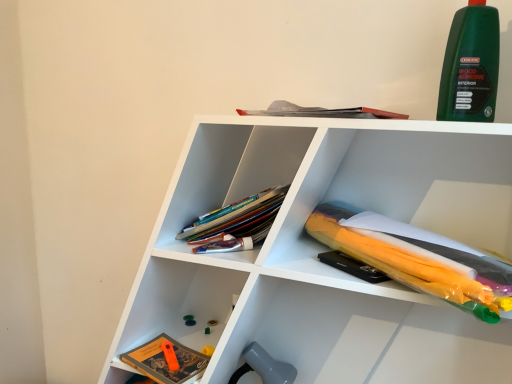
What do you see at coordinates (230, 171) in the screenshot?
I see `matte plastic books at center` at bounding box center [230, 171].

This screenshot has height=384, width=512. What are the coordinates of `green plastic toy at lower center` in the screenshot? It's located at (189, 320).

Based on the photo, measure the distance between point (417,281) and camera.

Point (417,281) and camera are 72.80 centimeters apart.

In order to click on translucent plastic umbrella at lower right, the 2th book in the left-to-right sequence in this screenshot , I will do `click(412, 261)`.

Find the location of `green matte wood adhesive at upper right`. green matte wood adhesive at upper right is located at coordinates (470, 65).

Is translucent plastic umbrella at lower right, the 1th book in the top-to-bottom sequence, not close to matte plastic books at center?

Actually, translucent plastic umbrella at lower right, the 1th book in the top-to-bottom sequence, and matte plastic books at center are a little close together.

Considering the relative sizes of translucent plastic umbrella at lower right, the 2th book in the left-to-right sequence, and matte plastic books at center in the image provided, is translucent plastic umbrella at lower right, the 2th book in the left-to-right sequence, taller than matte plastic books at center?

No, translucent plastic umbrella at lower right, the 2th book in the left-to-right sequence, is not taller than matte plastic books at center.

From the image's perspective, is translucent plastic umbrella at lower right, the second book from the bottom, beneath matte plastic books at center?

Yes, from the image's perspective, translucent plastic umbrella at lower right, the second book from the bottom, is below matte plastic books at center.

At what (x,y) coordinates should I click in order to perform the action: click on book on the right of matte plastic books at center. Please return your answer as a coordinate pair (x, y). The height and width of the screenshot is (384, 512). Looking at the image, I should click on (412, 261).

Is hardcover book at lower left, which is counted as the 1th book, starting from the bottom, situated inside translucent plastic umbrella at lower right, the second book from the bottom, or outside?

hardcover book at lower left, which is counted as the 1th book, starting from the bottom, is not enclosed by translucent plastic umbrella at lower right, the second book from the bottom.

Is hardcover book at lower left, the 1th book viewed from the left, at the right side of translucent plastic umbrella at lower right, the 2th book in the left-to-right sequence?

No.

From a real-world perspective, which is physically above, hardcover book at lower left, the 1th book viewed from the left, or translucent plastic umbrella at lower right, the second book from the bottom?

In real-world perspective, translucent plastic umbrella at lower right, the second book from the bottom, is above.

Can you confirm if green plastic toy at lower center is smaller than hardcover book at lower left, marked as the second book in a top-to-bottom arrangement?

Yes.

Considering the relative sizes of green plastic toy at lower center and hardcover book at lower left, marked as the second book in a top-to-bottom arrangement, in the image provided, is green plastic toy at lower center wider than hardcover book at lower left, marked as the second book in a top-to-bottom arrangement,?

In fact, green plastic toy at lower center might be narrower than hardcover book at lower left, marked as the second book in a top-to-bottom arrangement.

What's the angular difference between green plastic toy at lower center and hardcover book at lower left, marked as the second book in a top-to-bottom arrangement,'s facing directions?

The angle between the facing direction of green plastic toy at lower center and the facing direction of hardcover book at lower left, marked as the second book in a top-to-bottom arrangement, is 23.3 degrees.

This screenshot has width=512, height=384. I want to click on book below the translucent plastic umbrella at lower right, the 2th book in the left-to-right sequence (from the image's perspective), so click(166, 361).

Is point (448, 275) positioned in front of point (193, 364)?

Yes, it is in front of point (193, 364).

Based on the photo, measure the distance between translucent plastic umbrella at lower right, which is counted as the first book, starting from the right, and hardcover book at lower left, which is counted as the 1th book, starting from the bottom.

translucent plastic umbrella at lower right, which is counted as the first book, starting from the right, and hardcover book at lower left, which is counted as the 1th book, starting from the bottom, are 20.51 inches apart from each other.

Considering the sizes of objects translucent plastic umbrella at lower right, which is counted as the first book, starting from the right, and hardcover book at lower left, the 1th book viewed from the left, in the image provided, who is thinner, translucent plastic umbrella at lower right, which is counted as the first book, starting from the right, or hardcover book at lower left, the 1th book viewed from the left,?

hardcover book at lower left, the 1th book viewed from the left, is thinner.

Consider the image. Is white plastic umbrella at upper right completely or partially inside hardcover book at lower left, marked as the second book in a top-to-bottom arrangement?

No, white plastic umbrella at upper right is not surrounded by hardcover book at lower left, marked as the second book in a top-to-bottom arrangement.

Considering the sizes of objects hardcover book at lower left, the second book positioned from the right, and white plastic umbrella at upper right in the image provided, who is wider, hardcover book at lower left, the second book positioned from the right, or white plastic umbrella at upper right?

With larger width is white plastic umbrella at upper right.

Between point (141, 352) and point (213, 137), which one is positioned behind?

Point (141, 352)

From the image's perspective, is hardcover book at lower left, the second book positioned from the right, on top of white plastic umbrella at upper right?

Incorrect, from the image's perspective, hardcover book at lower left, the second book positioned from the right, is lower than white plastic umbrella at upper right.

Is translucent plastic umbrella at lower right, the 2th book in the left-to-right sequence, smaller than green matte wood adhesive at upper right?

No.

Which object is wider, translucent plastic umbrella at lower right, the 1th book in the top-to-bottom sequence, or green matte wood adhesive at upper right?

Wider between the two is translucent plastic umbrella at lower right, the 1th book in the top-to-bottom sequence.

Which is in front, translucent plastic umbrella at lower right, the second book from the bottom, or green matte wood adhesive at upper right?

translucent plastic umbrella at lower right, the second book from the bottom, is more forward.

What's the angular difference between green matte wood adhesive at upper right and hardcover book at lower left, the 1th book viewed from the left,'s facing directions?

15.2 degrees.

From a real-world perspective, is green matte wood adhesive at upper right physically located above or below hardcover book at lower left, the second book positioned from the right?

In terms of real-world spatial position, green matte wood adhesive at upper right is above hardcover book at lower left, the second book positioned from the right.

Based on their sizes in the image, would you say green matte wood adhesive at upper right is bigger or smaller than hardcover book at lower left, the 1th book viewed from the left?

Clearly, green matte wood adhesive at upper right is larger in size than hardcover book at lower left, the 1th book viewed from the left.

In the scene shown: Which point is more forward, (447,63) or (143,369)?

The point (447,63) is more forward.

Locate an element on the screen. This screenshot has height=384, width=512. cabinet located above the translucent plastic umbrella at lower right, which is counted as the first book, starting from the right (from a real-world perspective) is located at coordinates (230, 171).

In order to click on book below the translucent plastic umbrella at lower right, which is counted as the first book, starting from the right (from the image's perspective) in this screenshot , I will do `click(166, 361)`.

When comparing their distances from green plastic toy at lower center, does matte plastic books at center or green matte wood adhesive at upper right seem further?

Among the two, green matte wood adhesive at upper right is located further to green plastic toy at lower center.

Based on their spatial positions, is hardcover book at lower left, the 1th book viewed from the left, or translucent plastic umbrella at lower right, which is counted as the first book, starting from the right, further from white plastic umbrella at upper right?

hardcover book at lower left, the 1th book viewed from the left, lies further to white plastic umbrella at upper right than the other object.

From the image, which object appears to be nearer to green plastic toy at lower center, translucent plastic umbrella at lower right, the 2th book in the left-to-right sequence, or matte plastic books at center?

The object closer to green plastic toy at lower center is matte plastic books at center.

Estimate the real-world distances between objects in this image. Which object is closer to translucent plastic umbrella at lower right, which is counted as the first book, starting from the right, matte plastic books at center or white plastic umbrella at upper right?

white plastic umbrella at upper right is positioned closer to the anchor translucent plastic umbrella at lower right, which is counted as the first book, starting from the right.

From the image, which object appears to be farther from translucent plastic umbrella at lower right, which is counted as the first book, starting from the right, green plastic toy at lower center or white plastic umbrella at upper right?

green plastic toy at lower center is positioned further to the anchor translucent plastic umbrella at lower right, which is counted as the first book, starting from the right.

Looking at the image, which one is located closer to green plastic toy at lower center, translucent plastic umbrella at lower right, the 2th book in the left-to-right sequence, or white plastic umbrella at upper right?

white plastic umbrella at upper right is closer to green plastic toy at lower center.

Which object lies further to the anchor point green matte wood adhesive at upper right, hardcover book at lower left, which is counted as the 1th book, starting from the bottom, or matte plastic books at center?

hardcover book at lower left, which is counted as the 1th book, starting from the bottom.

Which object lies further to the anchor point matte plastic books at center, hardcover book at lower left, which is counted as the 1th book, starting from the bottom, or translucent plastic umbrella at lower right, which is counted as the first book, starting from the right?

hardcover book at lower left, which is counted as the 1th book, starting from the bottom, is further to matte plastic books at center.

Identify the location of cabinet between green matte wood adhesive at upper right and hardcover book at lower left, the second book positioned from the right, in the vertical direction. This screenshot has width=512, height=384. click(x=230, y=171).

Locate an element on the screen. cabinet between hardcover book at lower left, the second book positioned from the right, and translucent plastic umbrella at lower right, the second book from the bottom, from left to right is located at coordinates point(230,171).

Identify the location of book between green matte wood adhesive at upper right and hardcover book at lower left, the 1th book viewed from the left, vertically. (412, 261).

Identify the location of cleaning product positioned between translucent plastic umbrella at lower right, the second book from the bottom, and green plastic toy at lower center from near to far. This screenshot has height=384, width=512. (470, 65).